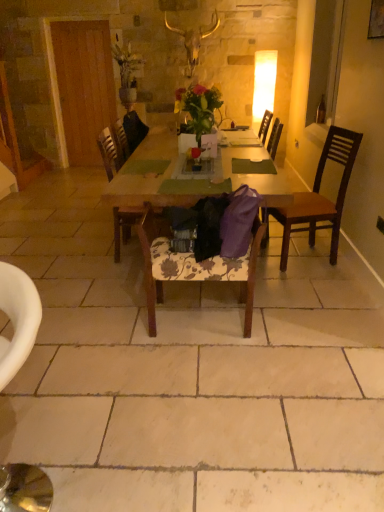
Question: Could you tell me if floral fabric chair at center, which is the 3th chair in back-to-front order, is turned towards brown wooden chair at right, which is the second chair from back to front?

Choices:
 (A) yes
 (B) no

Answer: (B)

Question: Is floral fabric chair at center, which is the 3th chair in back-to-front order, positioned in front of brown wooden chair at right, which is the fourth chair from left to right?

Choices:
 (A) yes
 (B) no

Answer: (A)

Question: From a real-world perspective, is floral fabric chair at center, arranged as the second chair when viewed from the front, physically above brown wooden chair at right, which is the first chair in right-to-left order?

Choices:
 (A) no
 (B) yes

Answer: (A)

Question: Can you confirm if floral fabric chair at center, which is the 3th chair in back-to-front order, is smaller than brown wooden chair at right, which is the first chair in right-to-left order?

Choices:
 (A) yes
 (B) no

Answer: (A)

Question: Is floral fabric chair at center, arranged as the third chair when viewed from the left, positioned with its back to brown wooden chair at right, positioned as the third chair in front-to-back order?

Choices:
 (A) no
 (B) yes

Answer: (A)

Question: From their relative heights in the image, would you say wooden chair at center, positioned as the 4th chair in front-to-back order, is taller or shorter than wooden table at center?

Choices:
 (A) tall
 (B) short

Answer: (A)

Question: Looking at their shapes, would you say wooden chair at center, positioned as the third chair in right-to-left order, is wider or thinner than wooden table at center?

Choices:
 (A) thin
 (B) wide

Answer: (A)

Question: In terms of size, does wooden chair at center, placed as the 1th chair when sorted from back to front, appear bigger or smaller than wooden table at center?

Choices:
 (A) big
 (B) small

Answer: (B)

Question: Does point (107, 162) appear closer or farther from the camera than point (153, 181)?

Choices:
 (A) farther
 (B) closer

Answer: (A)

Question: Considering the positions of vibrant floral bouquet at center and wooden picture frame at upper right in the image, is vibrant floral bouquet at center bigger or smaller than wooden picture frame at upper right?

Choices:
 (A) big
 (B) small

Answer: (A)

Question: Is point (185, 110) positioned closer to the camera than point (370, 9)?

Choices:
 (A) farther
 (B) closer

Answer: (A)

Question: Considering the positions of vibrant floral bouquet at center and wooden picture frame at upper right in the image, is vibrant floral bouquet at center taller or shorter than wooden picture frame at upper right?

Choices:
 (A) short
 (B) tall

Answer: (B)

Question: Looking at their shapes, would you say vibrant floral bouquet at center is wider or thinner than wooden picture frame at upper right?

Choices:
 (A) wide
 (B) thin

Answer: (A)

Question: In the image, is wooden picture frame at upper right positioned in front of or behind brown wooden chair at right, positioned as the third chair in front-to-back order?

Choices:
 (A) front
 (B) behind

Answer: (A)

Question: From a real-world perspective, relative to brown wooden chair at right, which is the second chair from back to front, is wooden picture frame at upper right vertically above or below?

Choices:
 (A) below
 (B) above

Answer: (B)